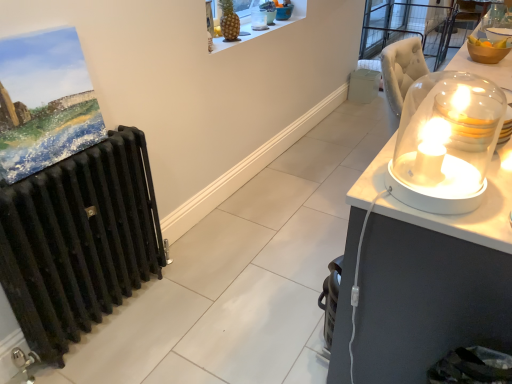
Identify the location of free space above black cast iron radiator at left (from a real-world perspective). (69, 153).